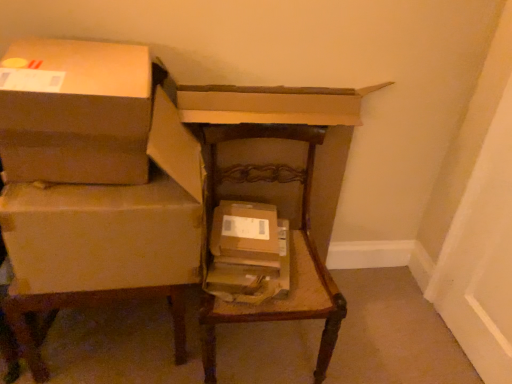
The width and height of the screenshot is (512, 384). I want to click on brown cardboard box at center, which appears as the third box when viewed from the left, so click(x=245, y=234).

Locate an element on the screen. brown cardboard box at upper left, which is the 1th box in left-to-right order is located at coordinates (76, 112).

The image size is (512, 384). I want to click on brown cardboard box at left, positioned as the second box in left-to-right order, so [101, 235].

Considering the sizes of objects brown cardboard box at left, positioned as the second box in right-to-left order, and brown cardboard boxes at left, placed as the 1th furniture when sorted from left to right, in the image provided, who is taller, brown cardboard box at left, positioned as the second box in right-to-left order, or brown cardboard boxes at left, placed as the 1th furniture when sorted from left to right,?

Standing taller between the two is brown cardboard boxes at left, placed as the 1th furniture when sorted from left to right.

Does brown cardboard box at left, positioned as the second box in left-to-right order, turn towards brown cardboard boxes at left, placed as the 1th furniture when sorted from left to right?

Yes, brown cardboard box at left, positioned as the second box in left-to-right order, is oriented towards brown cardboard boxes at left, placed as the 1th furniture when sorted from left to right.

From a real-world perspective, relative to brown cardboard boxes at left, placed as the 1th furniture when sorted from left to right, is brown cardboard box at left, positioned as the second box in left-to-right order, vertically above or below?

brown cardboard box at left, positioned as the second box in left-to-right order, is above brown cardboard boxes at left, placed as the 1th furniture when sorted from left to right.

Between brown cardboard box at left, positioned as the second box in left-to-right order, and brown cardboard boxes at left, placed as the 1th furniture when sorted from left to right, which one appears on the right side from the viewer's perspective?

From the viewer's perspective, brown cardboard box at left, positioned as the second box in left-to-right order, appears more on the right side.

Is brown cardboard box at left, positioned as the second box in right-to-left order, beside brown cardboard box at upper left, arranged as the third box when viewed from the right?

brown cardboard box at left, positioned as the second box in right-to-left order, and brown cardboard box at upper left, arranged as the third box when viewed from the right, are clearly separated.

Is point (196, 217) closer or farther from the camera than point (16, 150)?

Point (196, 217) appears to be farther away from the viewer than point (16, 150).

In order to click on the 1st box behind the brown cardboard box at upper left, arranged as the third box when viewed from the right in this screenshot , I will do `click(101, 235)`.

From the image's perspective, is brown cardboard box at left, positioned as the second box in right-to-left order, located beneath brown cardboard box at upper left, which is the 1th box in left-to-right order?

Yes.

From a real-world perspective, which object stands above the other?

From a 3D spatial view, brown cardboard box at center, which ranks as the 1th box in right-to-left order, is above.

Would you say wooden chair at center, placed as the second furniture when sorted from left to right, is outside brown cardboard box at center, which ranks as the 1th box in right-to-left order?

Yes, wooden chair at center, placed as the second furniture when sorted from left to right, is located beyond the bounds of brown cardboard box at center, which ranks as the 1th box in right-to-left order.

Between wooden chair at center, the first furniture when ordered from right to left, and brown cardboard box at center, which ranks as the 1th box in right-to-left order, which one appears on the right side from the viewer's perspective?

Positioned to the right is wooden chair at center, the first furniture when ordered from right to left.

Which point is more forward, [291,128] or [213,224]?

The point [213,224] is closer.

Considering the relative sizes of brown cardboard box at upper left, which is the 1th box in left-to-right order, and brown cardboard box at left, positioned as the second box in right-to-left order, in the image provided, is brown cardboard box at upper left, which is the 1th box in left-to-right order, bigger than brown cardboard box at left, positioned as the second box in right-to-left order,?

Actually, brown cardboard box at upper left, which is the 1th box in left-to-right order, might be smaller than brown cardboard box at left, positioned as the second box in right-to-left order.

Considering the relative positions of brown cardboard box at upper left, which is the 1th box in left-to-right order, and brown cardboard box at left, positioned as the second box in right-to-left order, in the image provided, is brown cardboard box at upper left, which is the 1th box in left-to-right order, to the right of brown cardboard box at left, positioned as the second box in right-to-left order, from the viewer's perspective?

No.

In the scene shown: From the image's perspective, which one is positioned lower, brown cardboard box at upper left, arranged as the third box when viewed from the right, or brown cardboard box at left, positioned as the second box in right-to-left order?

brown cardboard box at left, positioned as the second box in right-to-left order, from the image's perspective.

Is brown cardboard box at upper left, which is the 1th box in left-to-right order, turned away from brown cardboard box at left, positioned as the second box in left-to-right order?

No.

Considering the relative sizes of brown cardboard boxes at left, placed as the 1th furniture when sorted from left to right, and brown cardboard box at upper left, which is the 1th box in left-to-right order, in the image provided, is brown cardboard boxes at left, placed as the 1th furniture when sorted from left to right, taller than brown cardboard box at upper left, which is the 1th box in left-to-right order,?

Indeed, brown cardboard boxes at left, placed as the 1th furniture when sorted from left to right, has a greater height compared to brown cardboard box at upper left, which is the 1th box in left-to-right order.

Considering the positions of objects brown cardboard boxes at left, placed as the 2th furniture when sorted from right to left, and brown cardboard box at upper left, arranged as the third box when viewed from the right, in the image provided, who is in front, brown cardboard boxes at left, placed as the 2th furniture when sorted from right to left, or brown cardboard box at upper left, arranged as the third box when viewed from the right,?

brown cardboard boxes at left, placed as the 2th furniture when sorted from right to left, is closer to the camera.

Which object is positioned more to the right, brown cardboard boxes at left, placed as the 2th furniture when sorted from right to left, or brown cardboard box at upper left, arranged as the third box when viewed from the right?

brown cardboard box at upper left, arranged as the third box when viewed from the right, is more to the right.

Is brown cardboard box at upper left, arranged as the third box when viewed from the right, positioned far away from brown cardboard boxes at left, placed as the 1th furniture when sorted from left to right?

No, there isn't a large distance between brown cardboard box at upper left, arranged as the third box when viewed from the right, and brown cardboard boxes at left, placed as the 1th furniture when sorted from left to right.

Does brown cardboard box at upper left, which is the 1th box in left-to-right order, lie in front of brown cardboard boxes at left, placed as the 2th furniture when sorted from right to left?

No, brown cardboard box at upper left, which is the 1th box in left-to-right order, is further to the viewer.

Does brown cardboard box at upper left, which is the 1th box in left-to-right order, contain brown cardboard boxes at left, placed as the 1th furniture when sorted from left to right?

No.

Considering the relative positions of brown cardboard box at upper left, which is the 1th box in left-to-right order, and brown cardboard boxes at left, placed as the 1th furniture when sorted from left to right, in the image provided, is brown cardboard box at upper left, which is the 1th box in left-to-right order, to the right of brown cardboard boxes at left, placed as the 1th furniture when sorted from left to right, from the viewer's perspective?

Yes, brown cardboard box at upper left, which is the 1th box in left-to-right order, is to the right of brown cardboard boxes at left, placed as the 1th furniture when sorted from left to right.

Which is in front, brown cardboard box at center, which appears as the third box when viewed from the left, or wooden chair at center, placed as the second furniture when sorted from left to right?

wooden chair at center, placed as the second furniture when sorted from left to right.

Is brown cardboard box at center, which ranks as the 1th box in right-to-left order, surrounding wooden chair at center, the first furniture when ordered from right to left?

No.

Consider the image. How much distance is there between brown cardboard box at center, which ranks as the 1th box in right-to-left order, and wooden chair at center, placed as the second furniture when sorted from left to right?

4.16 inches.

From a real-world perspective, which furniture is the 1st one underneath the brown cardboard box at left, positioned as the second box in right-to-left order? Please provide its 2D coordinates.

[(95, 184)]

Where is `the 1st box below when counting from the brown cardboard box at upper left, arranged as the third box when viewed from the right (from the image's perspective)`? the 1st box below when counting from the brown cardboard box at upper left, arranged as the third box when viewed from the right (from the image's perspective) is located at coordinates (101, 235).

Which object lies further to the anchor point brown cardboard box at center, which appears as the third box when viewed from the left, wooden chair at center, the first furniture when ordered from right to left, or brown cardboard box at upper left, which is the 1th box in left-to-right order?

brown cardboard box at upper left, which is the 1th box in left-to-right order.

When comparing their distances from brown cardboard boxes at left, placed as the 2th furniture when sorted from right to left, does brown cardboard box at upper left, arranged as the third box when viewed from the right, or brown cardboard box at center, which ranks as the 1th box in right-to-left order, seem further?

Among the two, brown cardboard box at center, which ranks as the 1th box in right-to-left order, is located further to brown cardboard boxes at left, placed as the 2th furniture when sorted from right to left.

Which object lies nearer to the anchor point wooden chair at center, placed as the second furniture when sorted from left to right, brown cardboard box at left, positioned as the second box in left-to-right order, or brown cardboard boxes at left, placed as the 1th furniture when sorted from left to right?

brown cardboard boxes at left, placed as the 1th furniture when sorted from left to right.

From the image, which object appears to be nearer to brown cardboard box at upper left, arranged as the third box when viewed from the right, brown cardboard box at center, which ranks as the 1th box in right-to-left order, or brown cardboard box at left, positioned as the second box in right-to-left order?

brown cardboard box at left, positioned as the second box in right-to-left order, is closer to brown cardboard box at upper left, arranged as the third box when viewed from the right.

Estimate the real-world distances between objects in this image. Which object is further from brown cardboard box at upper left, arranged as the third box when viewed from the right, brown cardboard box at center, which appears as the third box when viewed from the left, or wooden chair at center, the first furniture when ordered from right to left?

brown cardboard box at center, which appears as the third box when viewed from the left, is positioned further to the anchor brown cardboard box at upper left, arranged as the third box when viewed from the right.

Which object lies further to the anchor point brown cardboard box at center, which appears as the third box when viewed from the left, brown cardboard box at left, positioned as the second box in right-to-left order, or wooden chair at center, the first furniture when ordered from right to left?

brown cardboard box at left, positioned as the second box in right-to-left order, lies further to brown cardboard box at center, which appears as the third box when viewed from the left, than the other object.

From the image, which object appears to be nearer to brown cardboard box at center, which appears as the third box when viewed from the left, brown cardboard box at upper left, which is the 1th box in left-to-right order, or wooden chair at center, placed as the second furniture when sorted from left to right?

wooden chair at center, placed as the second furniture when sorted from left to right, is positioned closer to the anchor brown cardboard box at center, which appears as the third box when viewed from the left.

Looking at the image, which one is located closer to brown cardboard box at center, which ranks as the 1th box in right-to-left order, wooden chair at center, the first furniture when ordered from right to left, or brown cardboard box at left, positioned as the second box in right-to-left order?

Among the two, wooden chair at center, the first furniture when ordered from right to left, is located nearer to brown cardboard box at center, which ranks as the 1th box in right-to-left order.

Where is `box between brown cardboard box at upper left, which is the 1th box in left-to-right order, and brown cardboard boxes at left, placed as the 1th furniture when sorted from left to right, from top to bottom`? Image resolution: width=512 pixels, height=384 pixels. box between brown cardboard box at upper left, which is the 1th box in left-to-right order, and brown cardboard boxes at left, placed as the 1th furniture when sorted from left to right, from top to bottom is located at coordinates (101, 235).

I want to click on box between brown cardboard box at left, positioned as the second box in left-to-right order, and wooden chair at center, placed as the second furniture when sorted from left to right, from left to right, so click(x=245, y=234).

Identify the location of box situated between brown cardboard box at upper left, which is the 1th box in left-to-right order, and brown cardboard box at center, which ranks as the 1th box in right-to-left order, from left to right. (101, 235).